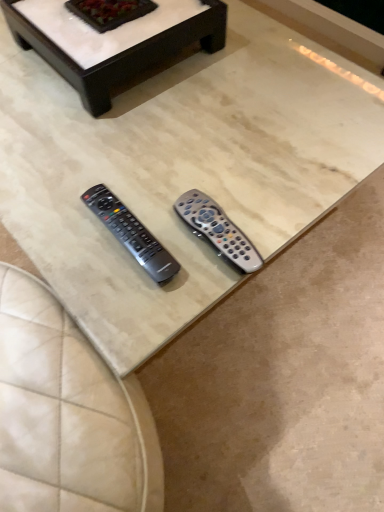
This screenshot has height=512, width=384. Identify the location of free space between silver metallic remote at center, which is counted as the first remote control, starting from the left, and white marble coffee table at upper center, which ranks as the first coffee table in back-to-front order. (138, 134).